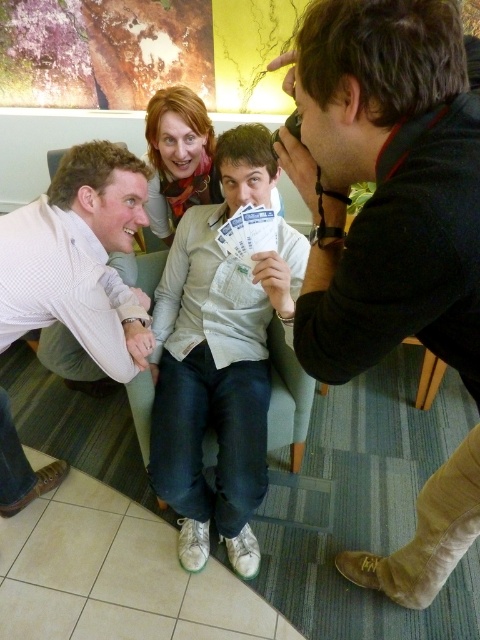
Is point (154, 227) positioned behind point (250, 227)?

Yes, point (154, 227) is farther from viewer.

What do you see at coordinates (178, 157) in the screenshot? Image resolution: width=480 pixels, height=640 pixels. I see `light beige sweater at center` at bounding box center [178, 157].

Locate an element on the screen. This screenshot has width=480, height=640. light beige sweater at center is located at coordinates (178, 157).

Does black leather camera at upper right come behind orange scarf at center?

No.

Is point (453, 476) in front of point (212, 195)?

Yes, point (453, 476) is closer to viewer.

Which is in front, point (352, 237) or point (154, 211)?

Point (352, 237)

Locate an element on the screen. black leather camera at upper right is located at coordinates (386, 182).

How much distance is there between orange scarf at center and white paper cards at center?

The distance of orange scarf at center from white paper cards at center is 23.78 inches.

Is orange scarf at center positioned at the back of white paper cards at center?

Yes.

Consider the image. Who is more forward, [169,182] or [228,218]?

Positioned in front is point [228,218].

Locate an element on the screen. This screenshot has height=640, width=480. orange scarf at center is located at coordinates point(178,157).